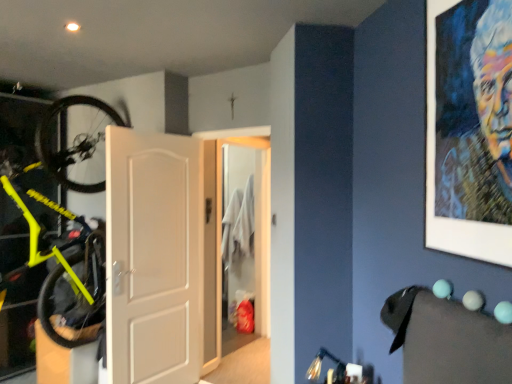
Question: Is white matte door at center, positioned as the second door in back-to-front order, turned away from neon yellow matte bicycle at left?

Choices:
 (A) yes
 (B) no

Answer: (A)

Question: Is white matte door at center, positioned as the 1th door in left-to-right order, completely or partially outside of neon yellow matte bicycle at left?

Choices:
 (A) no
 (B) yes

Answer: (B)

Question: Considering the relative sizes of white matte door at center, which is the 1th door in front-to-back order, and neon yellow matte bicycle at left in the image provided, is white matte door at center, which is the 1th door in front-to-back order, thinner than neon yellow matte bicycle at left?

Choices:
 (A) no
 (B) yes

Answer: (B)

Question: Is white matte door at center, positioned as the second door in back-to-front order, in contact with neon yellow matte bicycle at left?

Choices:
 (A) no
 (B) yes

Answer: (A)

Question: Considering the relative sizes of white matte door at center, which is the 1th door in front-to-back order, and neon yellow matte bicycle at left in the image provided, is white matte door at center, which is the 1th door in front-to-back order, taller than neon yellow matte bicycle at left?

Choices:
 (A) yes
 (B) no

Answer: (A)

Question: Is white matte door at center, positioned as the second door in back-to-front order, far from neon yellow matte bicycle at left?

Choices:
 (A) no
 (B) yes

Answer: (A)

Question: From a real-world perspective, is white matte door at center, the second door positioned from the right, beneath oil painting portrait at upper right?

Choices:
 (A) yes
 (B) no

Answer: (A)

Question: Does white matte door at center, positioned as the second door in back-to-front order, have a smaller size compared to oil painting portrait at upper right?

Choices:
 (A) yes
 (B) no

Answer: (B)

Question: Can you confirm if white matte door at center, positioned as the 1th door in left-to-right order, is wider than oil painting portrait at upper right?

Choices:
 (A) yes
 (B) no

Answer: (A)

Question: Is white matte door at center, positioned as the 1th door in left-to-right order, positioned before oil painting portrait at upper right?

Choices:
 (A) no
 (B) yes

Answer: (A)

Question: Considering the relative sizes of white matte door at center, positioned as the 1th door in left-to-right order, and oil painting portrait at upper right in the image provided, is white matte door at center, positioned as the 1th door in left-to-right order, thinner than oil painting portrait at upper right?

Choices:
 (A) no
 (B) yes

Answer: (A)

Question: Could you tell me if white matte door at center, which is the 1th door in front-to-back order, is turned towards oil painting portrait at upper right?

Choices:
 (A) yes
 (B) no

Answer: (A)

Question: Can you confirm if oil painting portrait at upper right is bigger than white matte door at center, positioned as the 1th door in left-to-right order?

Choices:
 (A) no
 (B) yes

Answer: (A)